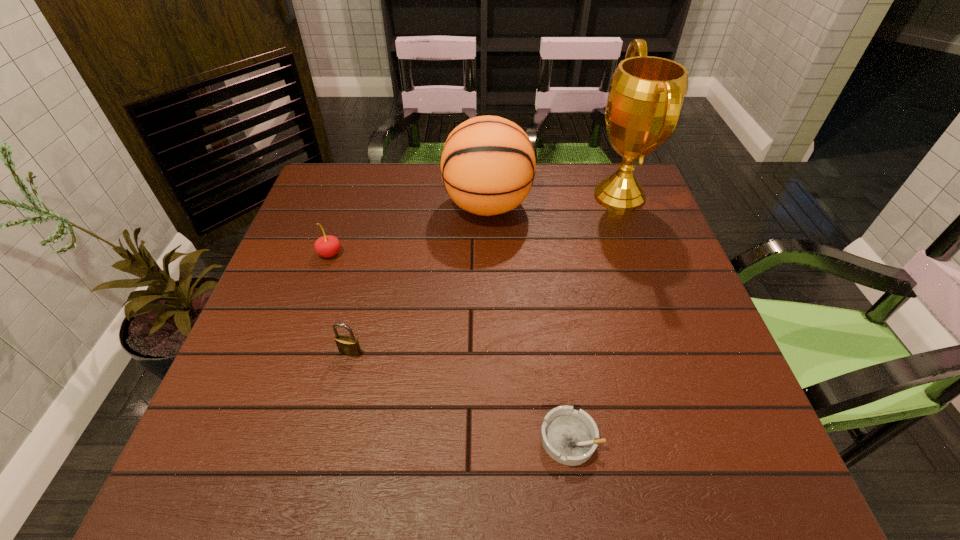
Locate an element on the screen. the rightmost object is located at coordinates pos(646,94).

The image size is (960, 540). I want to click on award, so click(646, 94).

At what (x,y) coordinates should I click in order to perform the action: click on the second tallest object. Please return your answer as a coordinate pair (x, y). Looking at the image, I should click on (488, 165).

Where is `the third nearest object`? the third nearest object is located at coordinates (326, 246).

This screenshot has height=540, width=960. Find the location of `cherry`. cherry is located at coordinates (326, 246).

Where is `the fourth farthest object`? The image size is (960, 540). the fourth farthest object is located at coordinates (346, 345).

Locate an element on the screen. The height and width of the screenshot is (540, 960). padlock is located at coordinates (346, 345).

Where is `the nearest object`? The width and height of the screenshot is (960, 540). the nearest object is located at coordinates (570, 437).

Find the location of a particular element. This screenshot has width=960, height=540. the shortest object is located at coordinates (570, 437).

I want to click on blank space located on the front-facing side of the tallest object, so click(548, 196).